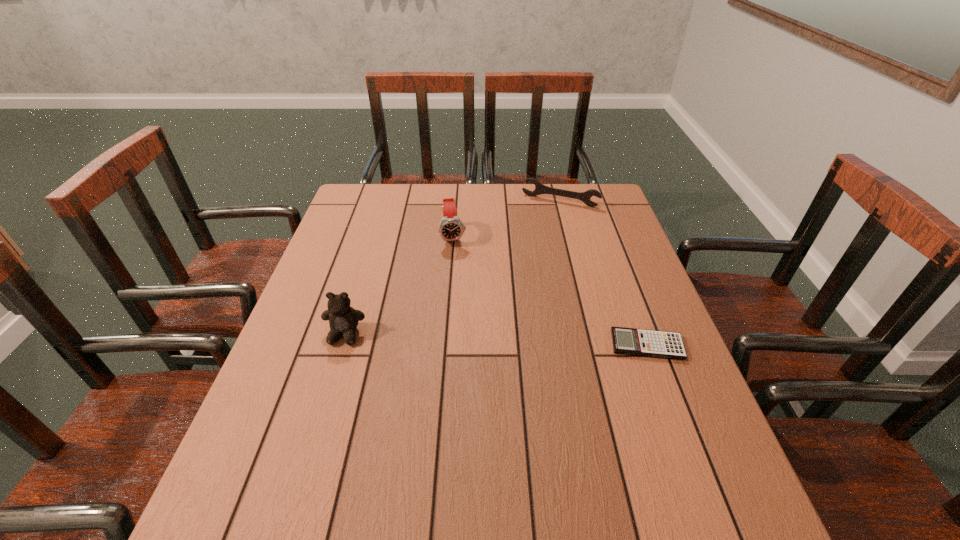
Identify the location of free space located on the open ends of the second shortest object. The width and height of the screenshot is (960, 540). (525, 259).

The image size is (960, 540). I want to click on vacant region located on the face of the watch, so click(462, 308).

You are a GUI agent. You are given a task and a screenshot of the screen. Output one action in this format:
    pyautogui.click(x=<x>, y=<y>)
    Task: Click on the vacant space situated 0.330m on the face of the watch
    The image size is (960, 540).
    Given the screenshot: What is the action you would take?
    pyautogui.click(x=465, y=331)

The height and width of the screenshot is (540, 960). What are the coordinates of `vacant area situated 0.260m on the face of the watch` in the screenshot? It's located at pos(462,310).

This screenshot has width=960, height=540. Identify the location of object located at the far edge. (585, 197).

The image size is (960, 540). In order to click on object that is at the left edge in this screenshot , I will do `click(343, 319)`.

Locate an element on the screen. calculator at the right edge is located at coordinates (658, 344).

At what (x,y) coordinates should I click in order to perform the action: click on wrench that is at the right edge. Please return your answer as a coordinate pair (x, y). The width and height of the screenshot is (960, 540). Looking at the image, I should click on click(x=585, y=197).

Find the location of a particular element. This screenshot has width=960, height=540. object at the far right corner is located at coordinates (585, 197).

This screenshot has height=540, width=960. Identify the location of blank space at the far edge of the desktop. (499, 195).